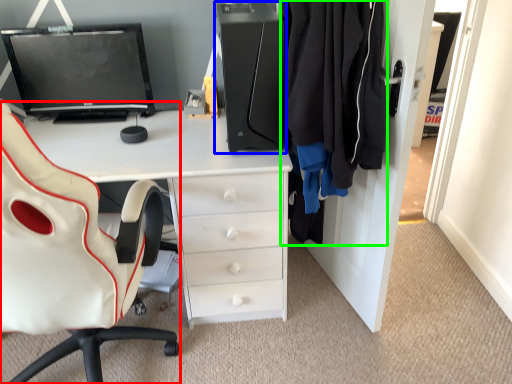
Question: Considering the real-world distances, which object is closest to chair (highlighted by a red box)? computer tower (highlighted by a blue box) or clothing (highlighted by a green box).

Choices:
 (A) computer tower
 (B) clothing

Answer: (A)